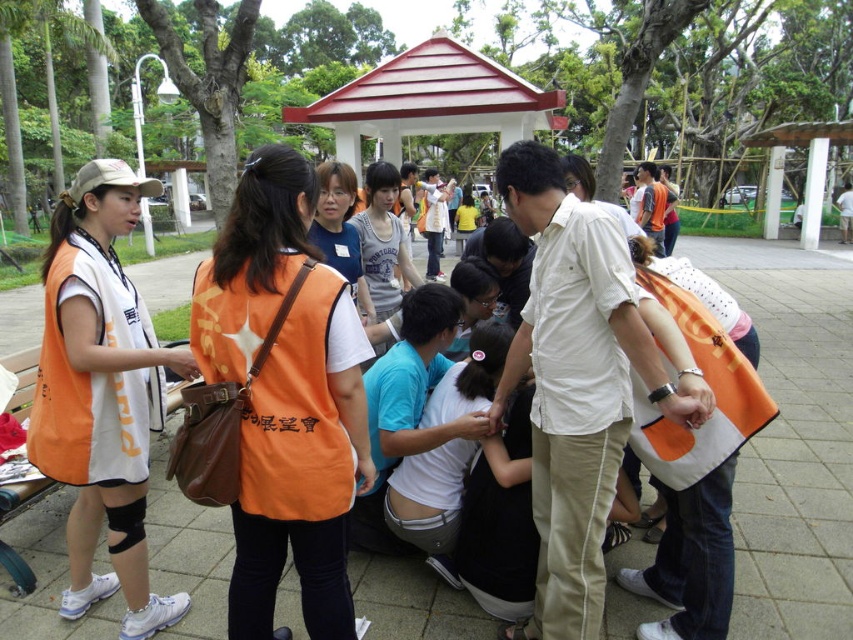
You are organizing a community event and need to place a 1.2 meter wide banner between the orange fabric vest at center and the white matte gazebo at center. Can the space accommodate the banner?

The orange fabric vest at center is thinner than the white matte gazebo at center, but the description does not provide exact measurements of the space between them. Without knowing the distance, it is uncertain if the banner will fit.

You are organizing a group photo and need to arrange two orange fabric vests for display. The orange fabric vest at center and the orange fabric vest at left must be placed side by side. Which vest should be placed on the left side to maintain proper size order from smallest to largest?

The orange fabric vest at center should be placed on the left side because it is smaller than the orange fabric vest at left, ensuring the size order from smallest to largest when viewed from left to right.